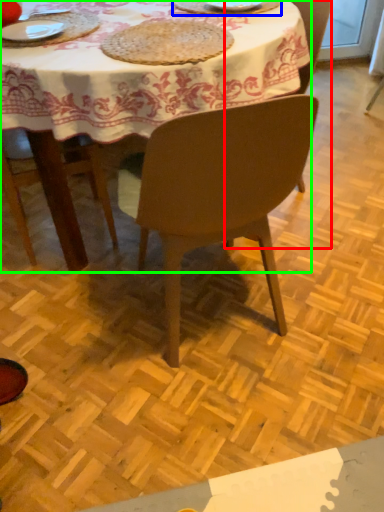
Question: Considering the real-world distances, which object is closest to chair (highlighted by a red box)? tableware (highlighted by a blue box) or kitchen & dining room table (highlighted by a green box).

Choices:
 (A) tableware
 (B) kitchen & dining room table

Answer: (A)